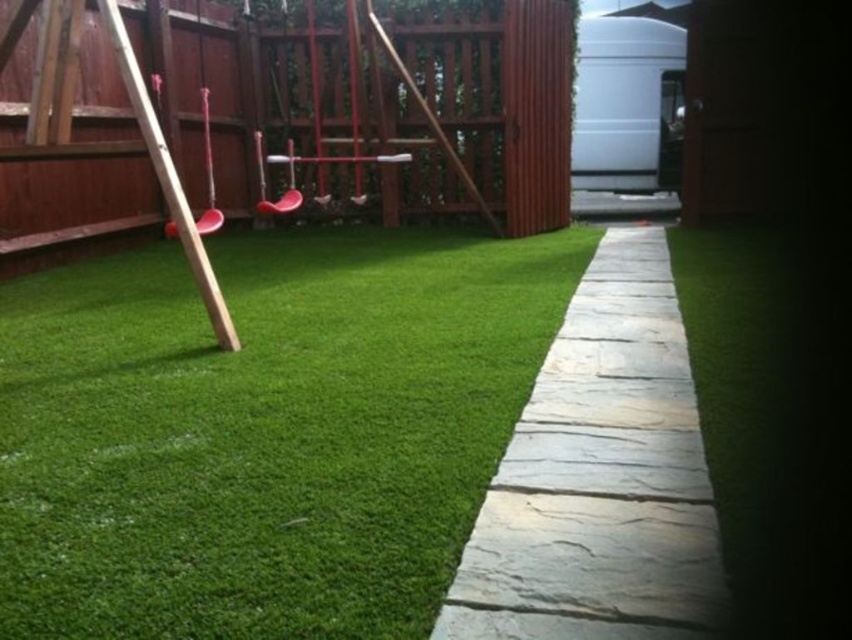
Can you confirm if green artificial turf at center is positioned to the right of gray stone path at center?

In fact, green artificial turf at center is to the left of gray stone path at center.

Is point (297, 492) positioned in front of point (510, 520)?

No.

Find the location of a particular element. This screenshot has height=640, width=852. green artificial turf at center is located at coordinates (263, 429).

Image resolution: width=852 pixels, height=640 pixels. Identify the location of green artificial turf at center. (263, 429).

Is green artificial turf at center smaller than wooden fence at upper left?

Yes, green artificial turf at center is smaller than wooden fence at upper left.

Who is lower down, green artificial turf at center or wooden fence at upper left?

Positioned lower is green artificial turf at center.

At what (x,y) coordinates should I click in order to perform the action: click on green artificial turf at center. Please return your answer as a coordinate pair (x, y). The width and height of the screenshot is (852, 640). Looking at the image, I should click on (263, 429).

The image size is (852, 640). What are the coordinates of `wooden fence at upper left` in the screenshot? It's located at (376, 109).

Is point (243, 157) more distant than point (668, 632)?

Yes, it is.

This screenshot has height=640, width=852. What do you see at coordinates (376, 109) in the screenshot?
I see `wooden fence at upper left` at bounding box center [376, 109].

What are the coordinates of `wooden fence at upper left` in the screenshot? It's located at (376, 109).